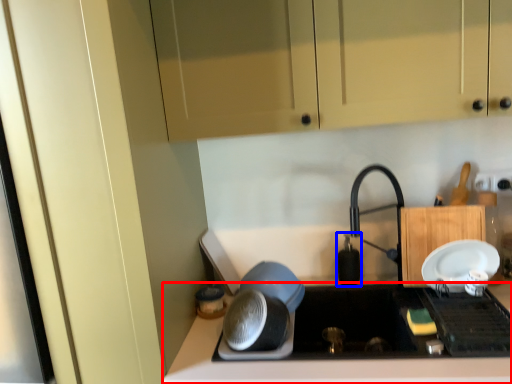
Question: Among these objects, which one is farthest to the camera, countertop (highlighted by a red box) or appliance (highlighted by a blue box)?

Choices:
 (A) countertop
 (B) appliance

Answer: (B)